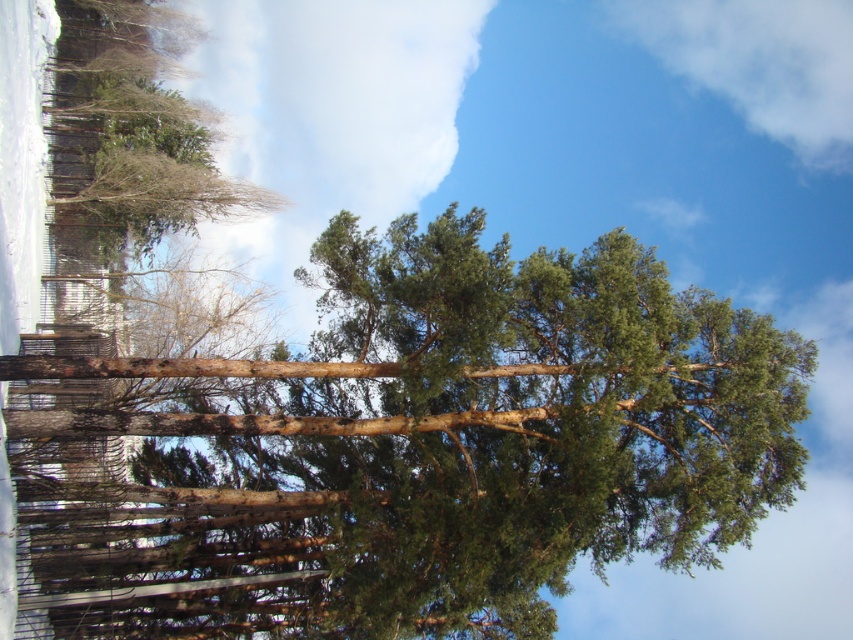
You are standing in the winter landscape looking at the large coniferous tree. There are two points marked in the image. One is at coordinate point (589, 248) and the other at point (851, 125). Which point is closer to you?

Point (589, 248) is in front of point (851, 125), so it is closer to you.